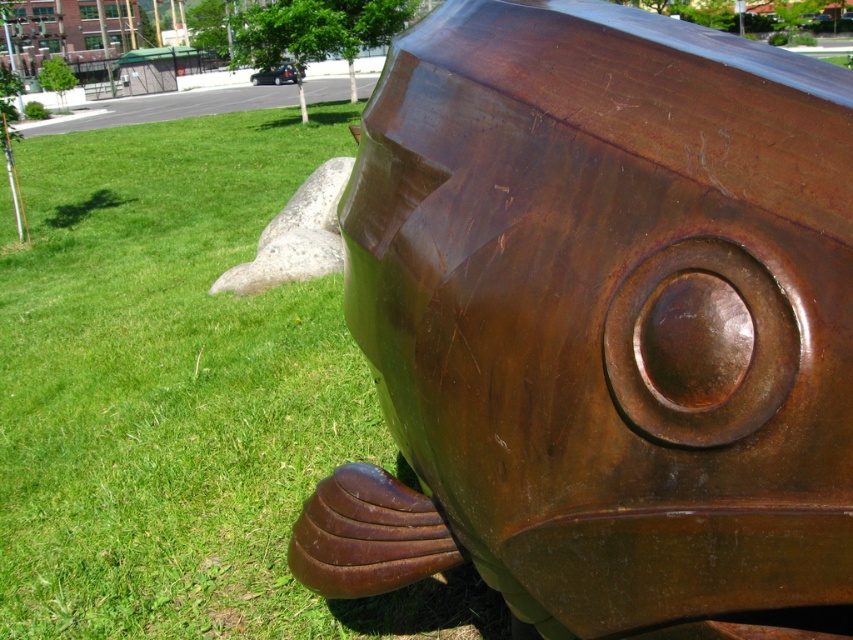
You are standing in a park and see the rusty metal fish at center. If you walk straight ahead, will you reach the sculpture before the large rock?

The rusty metal fish at center is located at point (601, 323). Since the coordinates place it centrally, you would reach the sculpture before encountering the large rock if you walk straight ahead.

You are standing in front of the fish sculpture and want to place a small decorative item exactly at the point marked as point (805,346). If the decorative item is 10 centimeters in diameter, will it fit without overlapping the sculpture?

The distance between point (805,346) and the viewer is 91.54 centimeters. Since the decorative item is only 10 centimeters in diameter, there is sufficient space, so it will fit without overlapping the sculpture.

You are standing in a park and see the rusty metal fish at center and the green grass at lower left. Which object is positioned lower in the image?

The rusty metal fish at center is located below green grass at lower left, so it is positioned lower in the image.